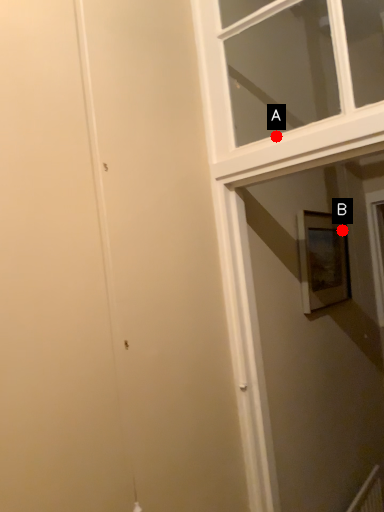
Question: Two points are circled on the image, labeled by A and B beside each circle. Which point is closer to the camera?

Choices:
 (A) A is closer
 (B) B is closer

Answer: (A)